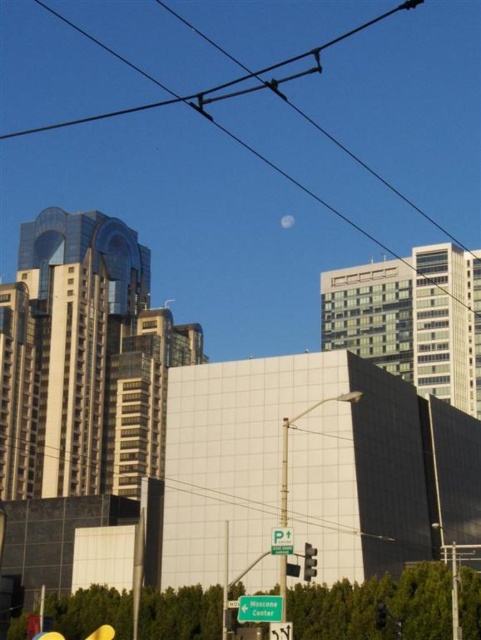
Question: Among these objects, which one is nearest to the camera?

Choices:
 (A) green plastic parking sign at center
 (B) black wire at upper center

Answer: (A)

Question: Is green plastic sign at center closer to camera compared to transparent glass traffic light at center?

Choices:
 (A) no
 (B) yes

Answer: (B)

Question: Among these points, which one is nearest to the camera?

Choices:
 (A) (380, 611)
 (B) (313, 570)

Answer: (B)

Question: Does black wire at upper center have a greater width compared to transparent glass traffic light at center?

Choices:
 (A) no
 (B) yes

Answer: (B)

Question: Is red glass traffic light at center wider than metallic traffic light at center?

Choices:
 (A) yes
 (B) no

Answer: (A)

Question: Among these points, which one is nearest to the camera?

Choices:
 (A) (377, 627)
 (B) (49, 202)
 (C) (249, 77)

Answer: (A)